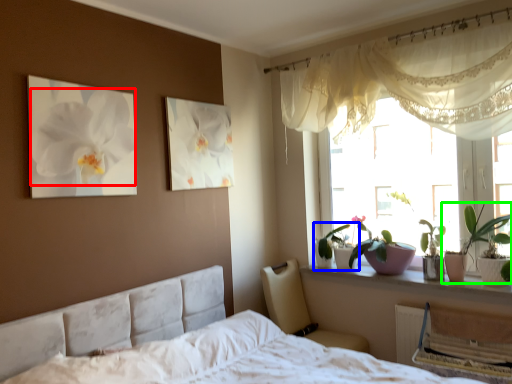
Question: Considering the real-world distances, which object is closest to flower (highlighted by a red box)? houseplant (highlighted by a blue box) or houseplant (highlighted by a green box).

Choices:
 (A) houseplant
 (B) houseplant

Answer: (A)